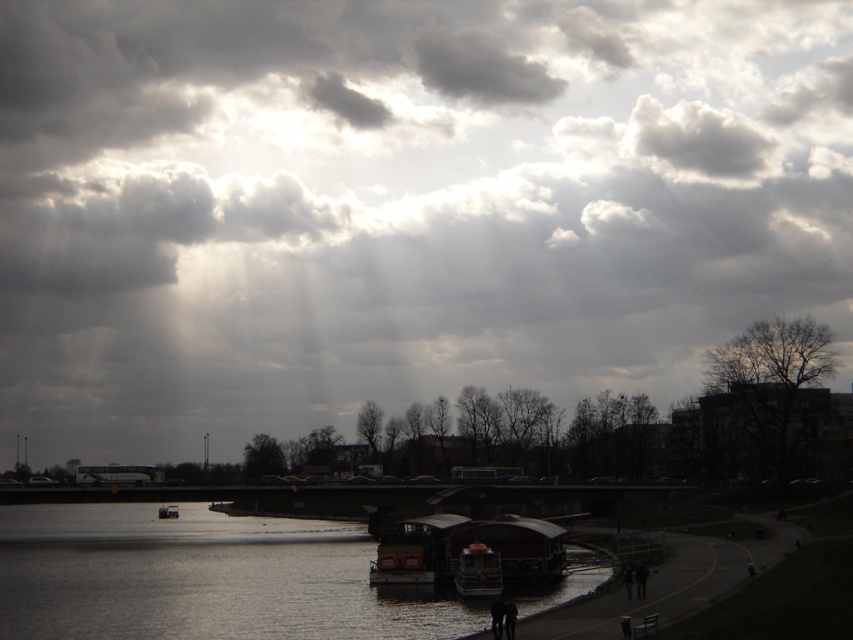
Who is shorter, metallic orange lifeboat at lower center or wooden boat at center?

metallic orange lifeboat at lower center

Is metallic orange lifeboat at lower center wider than wooden boat at center?

In fact, metallic orange lifeboat at lower center might be narrower than wooden boat at center.

Is point (492, 557) positioned in front of point (170, 515)?

Yes, it is.

You are a GUI agent. You are given a task and a screenshot of the screen. Output one action in this format:
    pyautogui.click(x=<x>, y=<y>)
    Task: Click on the metallic orange lifeboat at lower center
    
    Given the screenshot: What is the action you would take?
    pyautogui.click(x=479, y=572)

Can you confirm if cloudy sky at upper center is shorter than metallic orange lifeboat at lower center?

No, cloudy sky at upper center is not shorter than metallic orange lifeboat at lower center.

Is point (390, 51) farther from camera compared to point (480, 596)?

Yes, point (390, 51) is farther from viewer.

Find the location of a particular element. cloudy sky at upper center is located at coordinates pyautogui.click(x=399, y=205).

Is silvery reflective water at lower center wider than metallic orange lifeboat at lower center?

Correct, the width of silvery reflective water at lower center exceeds that of metallic orange lifeboat at lower center.

Between point (152, 618) and point (498, 579), which one is positioned in front?

Point (152, 618)

Is point (462, 611) farther from camera compared to point (486, 589)?

That is False.

In order to click on silvery reflective water at lower center in this screenshot , I will do `click(202, 579)`.